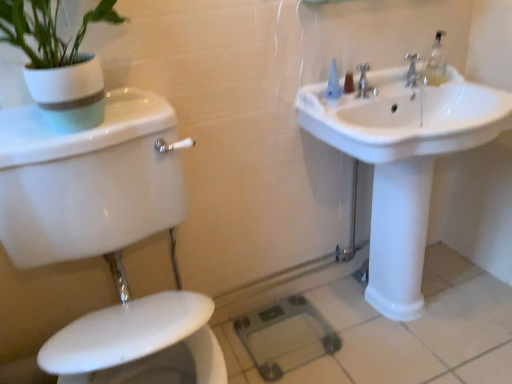
Question: Considering the positions of metallic silver faucet at upper right, which is counted as the 1th tap, starting from the right, and white glossy pot at upper left in the image, is metallic silver faucet at upper right, which is counted as the 1th tap, starting from the right, taller or shorter than white glossy pot at upper left?

Choices:
 (A) tall
 (B) short

Answer: (B)

Question: From a real-world perspective, relative to white glossy pot at upper left, is metallic silver faucet at upper right, which is counted as the 1th tap, starting from the right, vertically above or below?

Choices:
 (A) above
 (B) below

Answer: (B)

Question: Estimate the real-world distances between objects in this image. Which object is farther from the white glossy toilet at lower left?

Choices:
 (A) silver metallic faucet at upper center, the first tap in the left-to-right sequence
 (B) white glossy sink at upper right
 (C) white glossy pot at upper left
 (D) metallic silver faucet at upper right, the second tap in the left-to-right sequence

Answer: (D)

Question: Estimate the real-world distances between objects in this image. Which object is farther from the white glossy sink at upper right?

Choices:
 (A) silver metallic faucet at upper center, the first tap in the left-to-right sequence
 (B) white glossy pot at upper left
 (C) white glossy toilet at lower left
 (D) metallic silver faucet at upper right, which is counted as the 1th tap, starting from the right

Answer: (B)